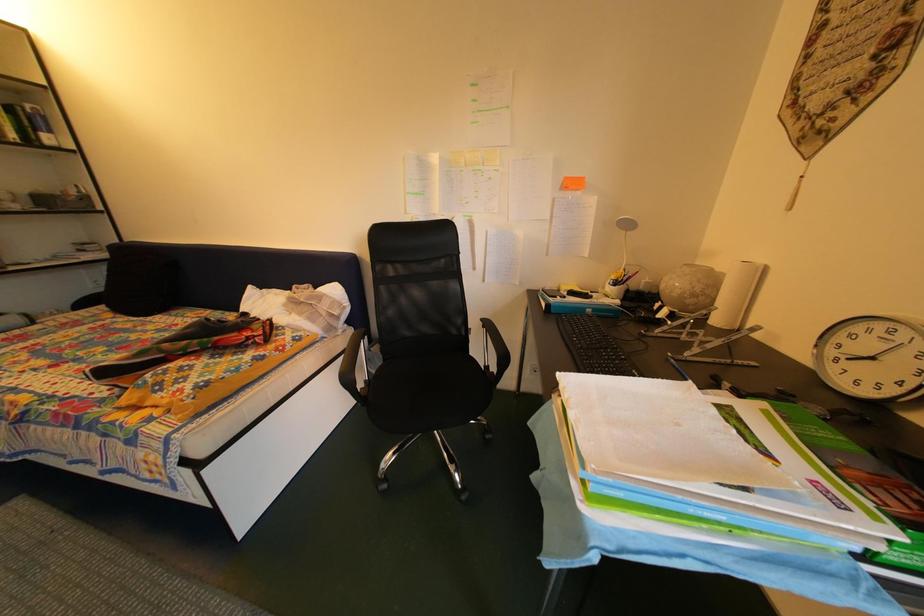
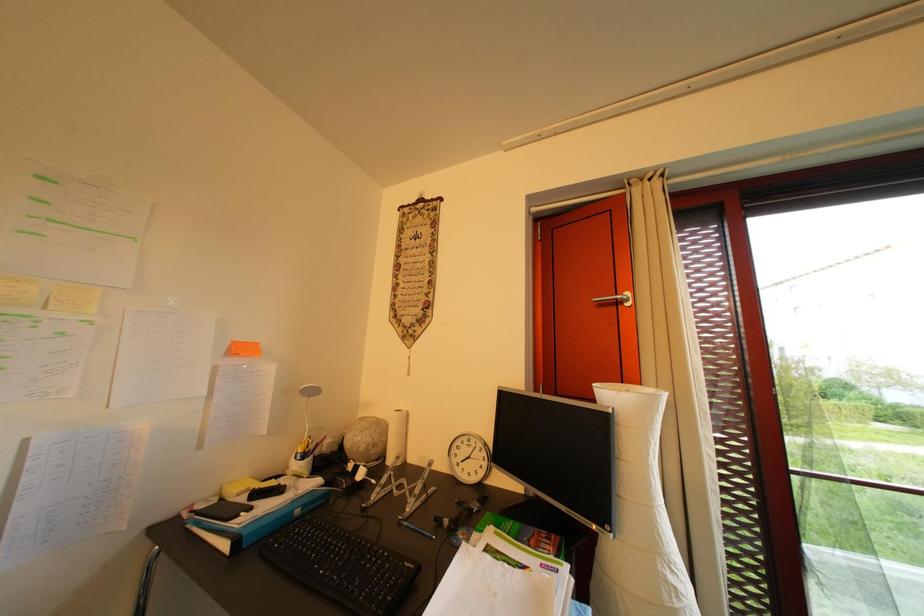
Question: The images are taken continuously from a first-person perspective. In which direction is your viewpoint rotating?

Choices:
 (A) Left
 (B) Right
 (C) Up
 (D) Down

Answer: (B)